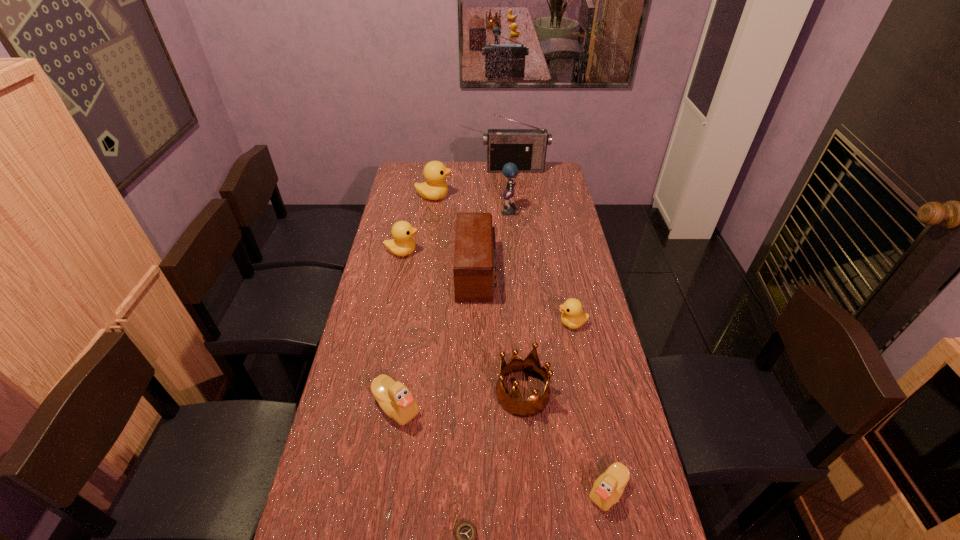
You are a GUI agent. You are given a task and a screenshot of the screen. Output one action in this format:
    pyautogui.click(x=<x>, y=<y>)
    Task: Click on the free space between the farther beige duck and the second smallest yellow duck
    The image size is (960, 540).
    Given the screenshot: What is the action you would take?
    pyautogui.click(x=399, y=329)

This screenshot has height=540, width=960. I want to click on vacant point located between the farthest duck and the second nearest duck, so click(x=416, y=301).

The image size is (960, 540). Identify the location of vacant point located between the blue rag doll and the tallest duck. (471, 205).

Identify the location of free space that is in between the crown and the rag doll. (516, 303).

Locate an element on the screen. vacant area that lies between the eighth nearest object and the crown is located at coordinates (516, 303).

At what (x,y) coordinates should I click in order to perform the action: click on vacant area that lies between the blue rag doll and the nearer beige duck. Please return your answer as a coordinate pair (x, y). The width and height of the screenshot is (960, 540). Looking at the image, I should click on (559, 352).

Identify the location of object that is the seventh closest to the nearer radio receiver. (526, 148).

Locate an element on the screen. the ninth closest object to the pocket watch is located at coordinates (526, 148).

You are a GUI agent. You are given a task and a screenshot of the screen. Output one action in this format:
    pyautogui.click(x=<x>, y=<y>)
    Task: Click on the duck that is the closest to the crown
    
    Given the screenshot: What is the action you would take?
    pyautogui.click(x=608, y=488)

In order to click on the closest duck to the shortest object in this screenshot , I will do `click(394, 398)`.